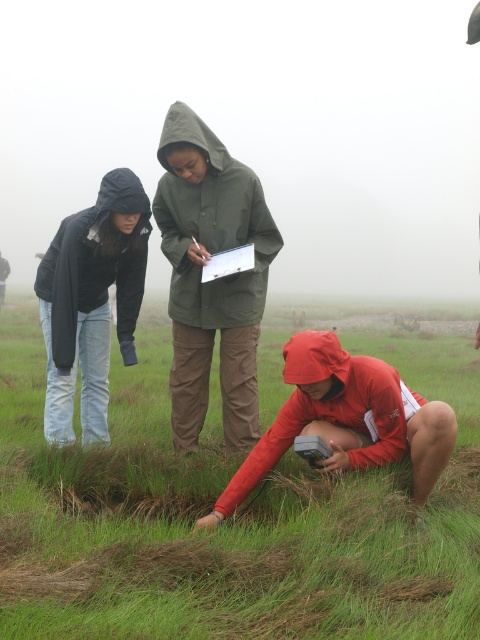
Based on the provided scene description, where is the green matte raincoat at center located in terms of coordinates?

The green matte raincoat at center is located at coordinates point [214,280].

You are standing at the point labeled point (384,403) and want to walk to the point labeled point (184,413). Is the point you want to reach located in front of or behind you relative to your current position?

The point labeled point (184,413) is behind point (384,403), so the desired location is behind your current position.